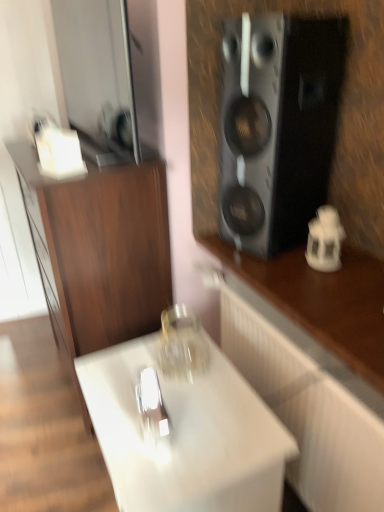
Identify the location of free space to the left of transparent glass jar at center. The width and height of the screenshot is (384, 512). (124, 375).